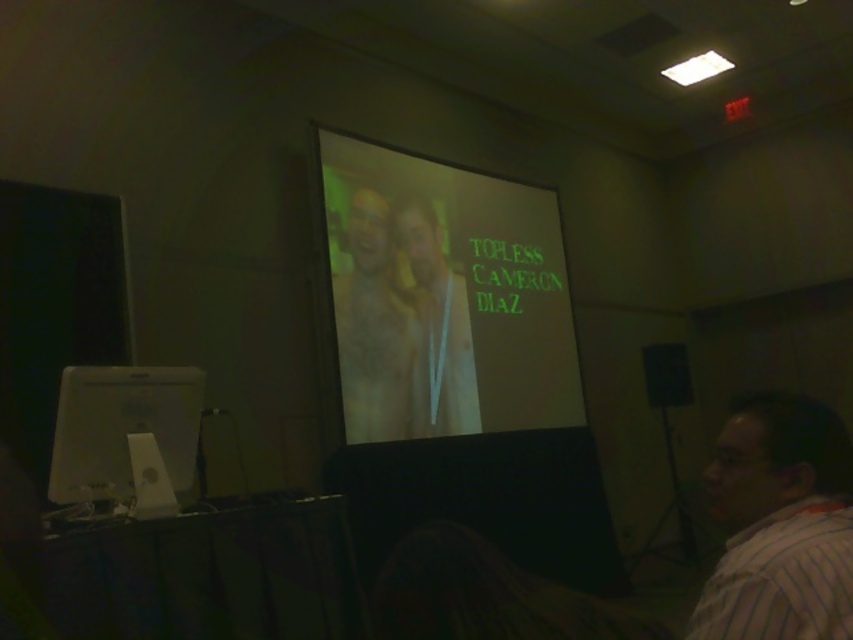
Question: Is matte white poster at center to the left of matte yellow shirt at center from the viewer's perspective?

Choices:
 (A) yes
 (B) no

Answer: (B)

Question: Among these points, which one is farthest from the camera?

Choices:
 (A) (438, 285)
 (B) (381, 376)
 (C) (759, 557)
 (D) (380, 289)

Answer: (A)

Question: Is matte white poster at center below matte yellow shirt at center?

Choices:
 (A) yes
 (B) no

Answer: (B)

Question: Estimate the real-world distances between objects in this image. Which object is closer to the matte white poster at center?

Choices:
 (A) white glossy computer screen at lower left
 (B) smooth beige statue at center

Answer: (B)

Question: Which of the following is the farthest from the observer?

Choices:
 (A) matte white poster at center
 (B) smooth beige statue at center
 (C) matte yellow shirt at center
 (D) white glossy computer screen at lower left

Answer: (C)

Question: Is matte white poster at center in front of white glossy computer screen at lower left?

Choices:
 (A) no
 (B) yes

Answer: (A)